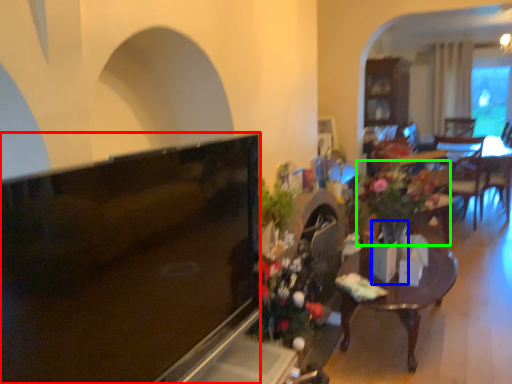
Question: Which object is positioned closest to television (highlighted by a red box)? Select from vase (highlighted by a blue box) and houseplant (highlighted by a green box).

Choices:
 (A) vase
 (B) houseplant

Answer: (A)